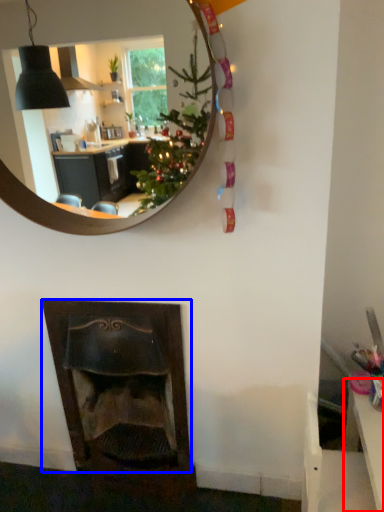
Question: Which of the following is the farthest to the observer, table (highlighted by a red box) or fireplace (highlighted by a blue box)?

Choices:
 (A) table
 (B) fireplace

Answer: (B)